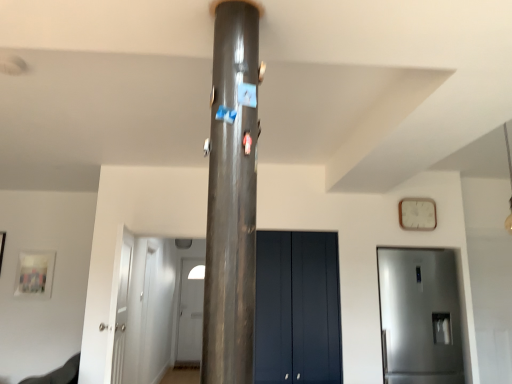
Question: Is white wooden clock at upper right with white glossy door at left, the 2th door when ordered from left to right?

Choices:
 (A) yes
 (B) no

Answer: (B)

Question: From the image's perspective, is white wooden clock at upper right under white glossy door at left, which ranks as the first door in front-to-back order?

Choices:
 (A) no
 (B) yes

Answer: (A)

Question: Considering the relative sizes of white wooden clock at upper right and white glossy door at left, which ranks as the first door in front-to-back order, in the image provided, is white wooden clock at upper right bigger than white glossy door at left, which ranks as the first door in front-to-back order,?

Choices:
 (A) yes
 (B) no

Answer: (B)

Question: Does white wooden clock at upper right come behind white glossy door at left, which ranks as the third door in right-to-left order?

Choices:
 (A) yes
 (B) no

Answer: (A)

Question: From a real-world perspective, is white wooden clock at upper right beneath white glossy door at left, which ranks as the first door in front-to-back order?

Choices:
 (A) yes
 (B) no

Answer: (B)

Question: Can you confirm if white wooden clock at upper right is wider than white glossy door at left, which ranks as the third door in right-to-left order?

Choices:
 (A) no
 (B) yes

Answer: (A)

Question: Is white wooden clock at upper right beside matte dark blue cabinet at center, placed as the 3th door when sorted from front to back?

Choices:
 (A) yes
 (B) no

Answer: (B)

Question: From the image's perspective, is white wooden clock at upper right on top of matte dark blue cabinet at center, placed as the 3th door when sorted from front to back?

Choices:
 (A) no
 (B) yes

Answer: (B)

Question: Is white wooden clock at upper right at the left side of matte dark blue cabinet at center, which ranks as the second door in right-to-left order?

Choices:
 (A) yes
 (B) no

Answer: (B)

Question: Is white wooden clock at upper right thinner than matte dark blue cabinet at center, placed as the 3th door when sorted from left to right?

Choices:
 (A) no
 (B) yes

Answer: (B)

Question: Does white wooden clock at upper right appear on the right side of matte dark blue cabinet at center, placed as the 3th door when sorted from front to back?

Choices:
 (A) no
 (B) yes

Answer: (B)

Question: Can you confirm if white wooden clock at upper right is bigger than matte dark blue cabinet at center, placed as the 3th door when sorted from left to right?

Choices:
 (A) yes
 (B) no

Answer: (B)

Question: Does satin silver refrigerator at right, positioned as the 4th door in left-to-right order, have a lesser height compared to shiny metallic pillar at center?

Choices:
 (A) yes
 (B) no

Answer: (B)